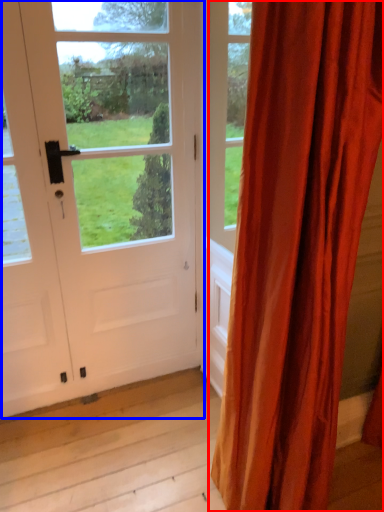
Question: Which object is further to the camera taking this photo, curtain (highlighted by a red box) or door (highlighted by a blue box)?

Choices:
 (A) curtain
 (B) door

Answer: (B)